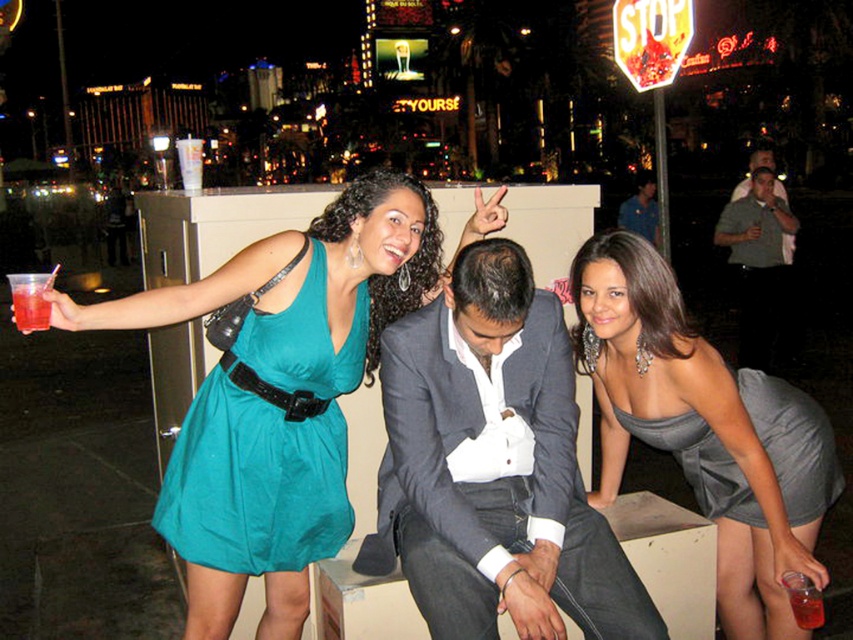
You are a photographer at the event. You want to ensure the teal satin dress at left is visible in the photo. Where should you position your camera relative to the point at coordinates [267,444]?

The teal satin dress at left is represented by the point at coordinates [267,444]. To ensure visibility, position the camera so that this point is within the frame.

You are standing at the origin point in the image. You want to walk to the point labeled point [744,289] and then to point [618,221]. Which point will you reach first?

You will reach point [744,289] first because it is in front of point [618,221].

You are a photographer at the event and need to ensure all items are visible in the photo. Given the teal satin dress at left and the translucent plastic cup at lower right, which object should you focus on first to ensure proper exposure, considering their sizes?

The teal satin dress at left should be focused on first because it has a larger size compared to the translucent plastic cup at lower right, making it more prominent in the frame.